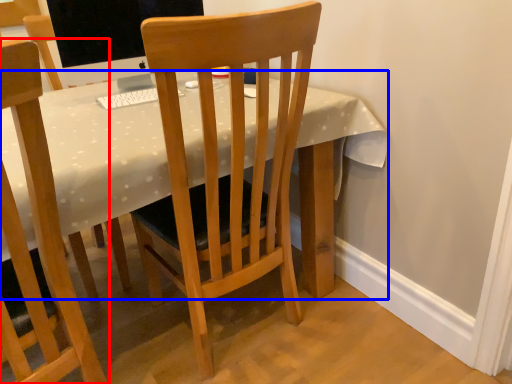
Question: Among these objects, which one is nearest to the camera, chair (highlighted by a red box) or desk (highlighted by a blue box)?

Choices:
 (A) chair
 (B) desk

Answer: (A)